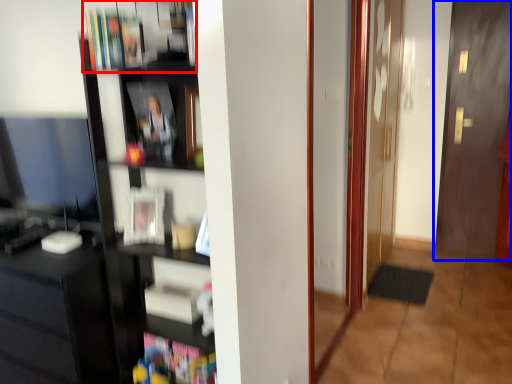
Question: Which point is further to the camera, book (highlighted by a red box) or door (highlighted by a blue box)?

Choices:
 (A) book
 (B) door

Answer: (B)